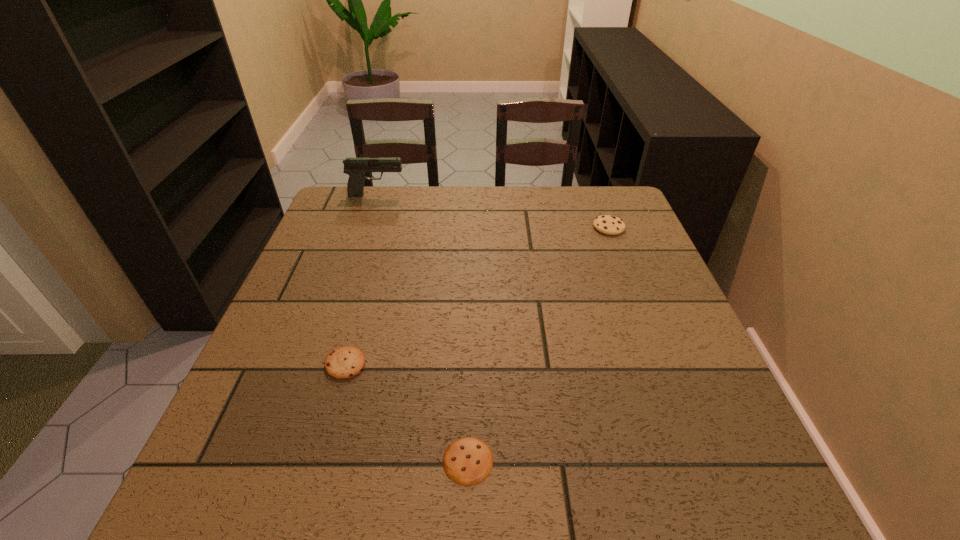
Identify the location of vacant point at the far edge. This screenshot has width=960, height=540. point(425,215).

You are a GUI agent. You are given a task and a screenshot of the screen. Output one action in this format:
    pyautogui.click(x=<x>, y=<y>)
    Task: Click on the free space at the near edge of the desktop
    
    Given the screenshot: What is the action you would take?
    pyautogui.click(x=576, y=476)

You are a GUI agent. You are given a task and a screenshot of the screen. Output one action in this format:
    pyautogui.click(x=<x>, y=<y>)
    Task: Click on the vacant point at the left edge
    
    Given the screenshot: What is the action you would take?
    pyautogui.click(x=262, y=361)

Find the location of a particular element. The height and width of the screenshot is (540, 960). vacant space at the right edge of the desktop is located at coordinates (633, 334).

Identify the location of free point between the second farthest cookie and the rightmost cookie. This screenshot has width=960, height=540. (477, 295).

At what (x,y) coordinates should I click in order to perform the action: click on free space between the second farthest cookie and the nearest object. Please return your answer as a coordinate pair (x, y). Looking at the image, I should click on (407, 412).

The height and width of the screenshot is (540, 960). What are the coordinates of `vacant area that lies between the leftmost cookie and the third object from left to right` in the screenshot? It's located at (407, 412).

Identify the location of unoccupied position between the tallest object and the second tallest object. (492, 211).

The height and width of the screenshot is (540, 960). In order to click on free space between the farthest cookie and the third object from left to right in this screenshot , I will do `click(539, 344)`.

The width and height of the screenshot is (960, 540). In order to click on free space between the second cookie from left to right and the farthest object in this screenshot , I will do `click(422, 328)`.